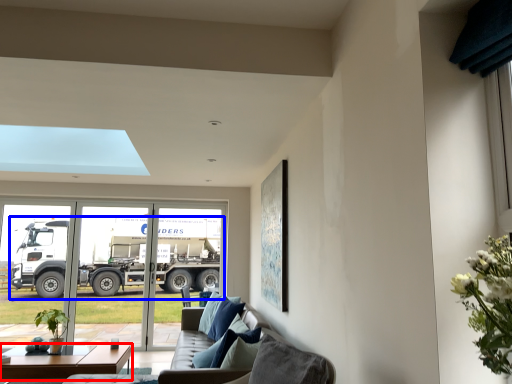
Question: Among these objects, which one is nearest to the camera, table (highlighted by a red box) or truck (highlighted by a blue box)?

Choices:
 (A) table
 (B) truck

Answer: (A)